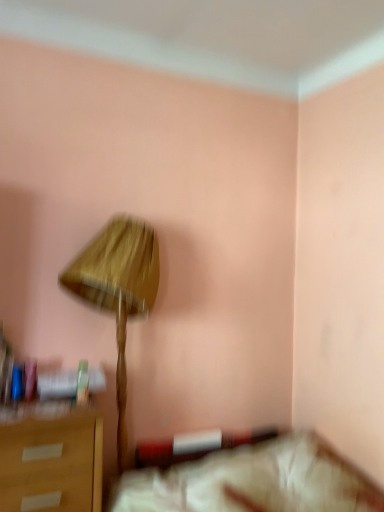
What do you see at coordinates (118, 290) in the screenshot?
I see `wooden lampshade at center` at bounding box center [118, 290].

Find the location of a particular element. wooden lampshade at center is located at coordinates (118, 290).

What is the approximate width of white fabric bed at lower right?

white fabric bed at lower right is 99.83 centimeters wide.

The height and width of the screenshot is (512, 384). What do you see at coordinates (253, 481) in the screenshot?
I see `white fabric bed at lower right` at bounding box center [253, 481].

Locate an element on the screen. white fabric bed at lower right is located at coordinates (253, 481).

Locate an element on the screen. wooden lampshade at center is located at coordinates (118, 290).

Can you confirm if wooden lampshade at center is positioned to the right of white fabric bed at lower right?

In fact, wooden lampshade at center is to the left of white fabric bed at lower right.

Does wooden lampshade at center lie in front of white fabric bed at lower right?

No, wooden lampshade at center is behind white fabric bed at lower right.

Which is behind, point (133, 291) or point (261, 482)?

The point (261, 482) is farther from the camera.

From the image's perspective, is wooden lampshade at center located above or below white fabric bed at lower right?

Based on their image positions, wooden lampshade at center is located above white fabric bed at lower right.

From a real-world perspective, is wooden lampshade at center under white fabric bed at lower right?

Incorrect, from a real-world perspective, wooden lampshade at center is higher than white fabric bed at lower right.

Is wooden lampshade at center thinner than white fabric bed at lower right?

Yes, wooden lampshade at center is thinner than white fabric bed at lower right.

From their relative heights in the image, would you say wooden lampshade at center is taller or shorter than white fabric bed at lower right?

Clearly, wooden lampshade at center is taller compared to white fabric bed at lower right.

Is wooden lampshade at center smaller than white fabric bed at lower right?

Yes.

Is white fabric bed at lower right located within wooden lampshade at center?

Definitely not — white fabric bed at lower right is not inside wooden lampshade at center.

Is wooden lampshade at center with white fabric bed at lower right?

No.

Is wooden lampshade at center oriented towards white fabric bed at lower right?

No, wooden lampshade at center does not turn towards white fabric bed at lower right.

What's the angular difference between wooden lampshade at center and white fabric bed at lower right's facing directions?

The angle between the facing direction of wooden lampshade at center and the facing direction of white fabric bed at lower right is 0.172 degrees.

Find the location of a particular element. This screenshot has width=384, height=512. furniture below the wooden lampshade at center (from the image's perspective) is located at coordinates (253, 481).

Is white fabric bed at lower right at the right side of wooden lampshade at center?

Yes, white fabric bed at lower right is to the right of wooden lampshade at center.

Considering their positions, is white fabric bed at lower right located in front of or behind wooden lampshade at center?

Clearly, white fabric bed at lower right is in front of wooden lampshade at center.

Which is further, (251,493) or (118,311)?

The point (118,311) is farther.

From the picture: From the image's perspective, is white fabric bed at lower right over wooden lampshade at center?

Incorrect, from the image's perspective, white fabric bed at lower right is lower than wooden lampshade at center.

From a real-world perspective, does white fabric bed at lower right sit lower than wooden lampshade at center?

Yes, from a real-world perspective, white fabric bed at lower right is under wooden lampshade at center.

Considering the relative sizes of white fabric bed at lower right and wooden lampshade at center in the image provided, is white fabric bed at lower right wider than wooden lampshade at center?

Yes, white fabric bed at lower right is wider than wooden lampshade at center.

In terms of height, does white fabric bed at lower right look taller or shorter compared to wooden lampshade at center?

In the image, white fabric bed at lower right appears to be shorter than wooden lampshade at center.

Can you confirm if white fabric bed at lower right is smaller than wooden lampshade at center?

Actually, white fabric bed at lower right might be larger than wooden lampshade at center.

Is white fabric bed at lower right not inside wooden lampshade at center?

white fabric bed at lower right lies outside wooden lampshade at center's area.

Is white fabric bed at lower right positioned far away from wooden lampshade at center?

No, white fabric bed at lower right is not far away from wooden lampshade at center.

Is white fabric bed at lower right oriented towards wooden lampshade at center?

No, white fabric bed at lower right is not oriented towards wooden lampshade at center.

Measure the distance between white fabric bed at lower right and wooden lampshade at center.

white fabric bed at lower right and wooden lampshade at center are 29.34 inches apart.

Identify the location of lamp that appears behind the white fabric bed at lower right. The image size is (384, 512). (118, 290).

Locate an element on the screen. The image size is (384, 512). lamp behind the white fabric bed at lower right is located at coordinates (118, 290).

Find the location of `furniture below the wooden lampshade at center (from a real-world perspective)`. furniture below the wooden lampshade at center (from a real-world perspective) is located at coordinates (253, 481).